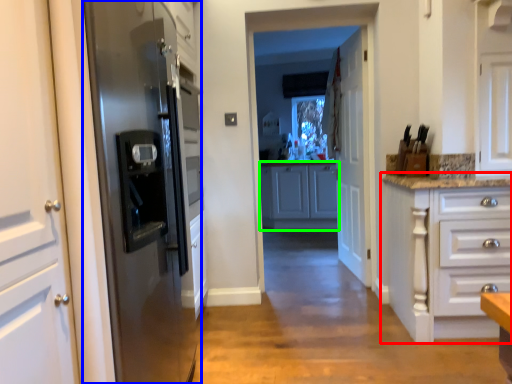
Question: Which object is the farthest from cabinetry (highlighted by a red box)? Choose among these: refrigerator (highlighted by a blue box) or cabinetry (highlighted by a green box).

Choices:
 (A) refrigerator
 (B) cabinetry

Answer: (B)